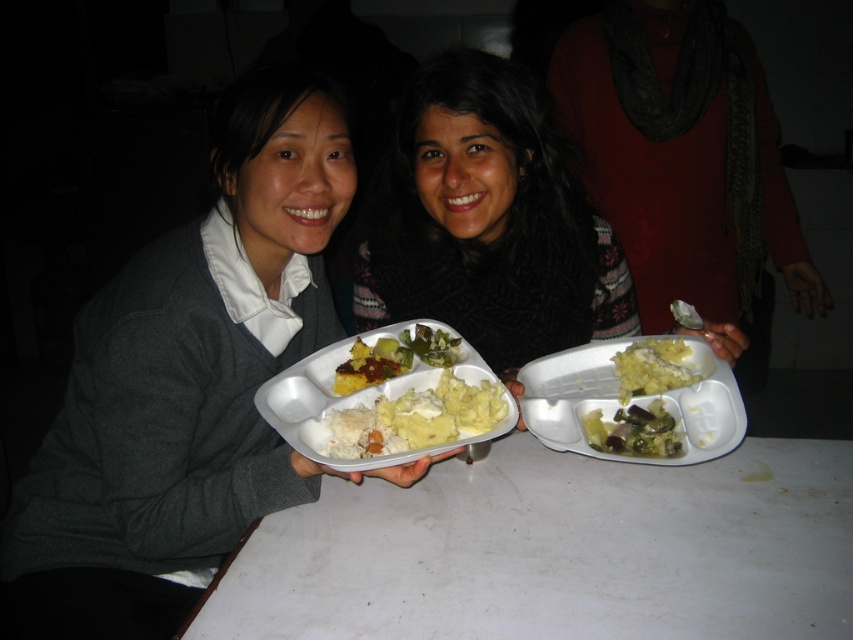
You are a server at a restaurant and need to place a new tray on the table. Based on the scene, can you determine if the white matte tray at center will fit on the white matte table at center without hanging over the edges?

The white matte table at center is not as tall as white matte tray at center, meaning the tray is taller. However, the question concerns the tray fitting on the table without overhanging, which relates to width or length, not height. Since the description only provides information about their heights, we cannot determine if the tray will fit on the table based on the given details.

You are a food critic observing two trays of food. The trays belong to the two people sitting at the table. You notice the yellowish matte mashed potatoes at center and the green matte mashed potatoes at center. Which of these two mashed potato dishes is positioned higher on their respective tray?

The yellowish matte mashed potatoes at center is located above the green matte mashed potatoes at center, so it is positioned higher on their respective tray.

You are standing in front of the table where the two individuals are seated. Which object from the following list is positioned closer to the left edge of the table? The options are the matte gray sweater at left and the patterned sweater with a red garment underneath on the right.

The matte gray sweater at left is located at point (186, 384), which is closer to the left edge of the table compared to the other sweater.